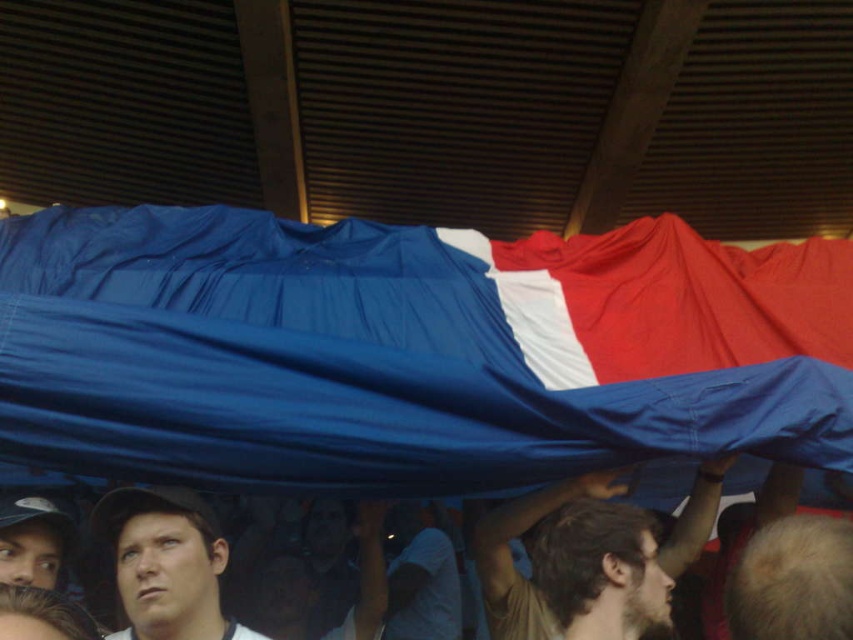
Is blue fabric flag at upper center positioned in front of matte white cap at center?

No, blue fabric flag at upper center is further to the viewer.

Is blue fabric flag at upper center further to camera compared to matte white cap at center?

Yes, blue fabric flag at upper center is behind matte white cap at center.

Is point (254, 481) behind point (138, 541)?

Yes, point (254, 481) is farther from viewer.

The width and height of the screenshot is (853, 640). I want to click on blue fabric flag at upper center, so click(407, 349).

Who is more distant from viewer, (102, 612) or (70, 548)?

The point (102, 612) is more distant.

Between point (106, 589) and point (50, 570), which one is positioned in front?

Positioned in front is point (50, 570).

The width and height of the screenshot is (853, 640). Identify the location of blue fabric at center. (660, 484).

Which is above, blue fabric flag at upper center or brown textured shirt at center?

blue fabric flag at upper center is above.

Does blue fabric flag at upper center appear on the right side of brown textured shirt at center?

In fact, blue fabric flag at upper center is to the left of brown textured shirt at center.

Which is in front, point (282, 356) or point (505, 532)?

Point (282, 356)

Find the location of `blue fabric flag at upper center`. blue fabric flag at upper center is located at coordinates (407, 349).